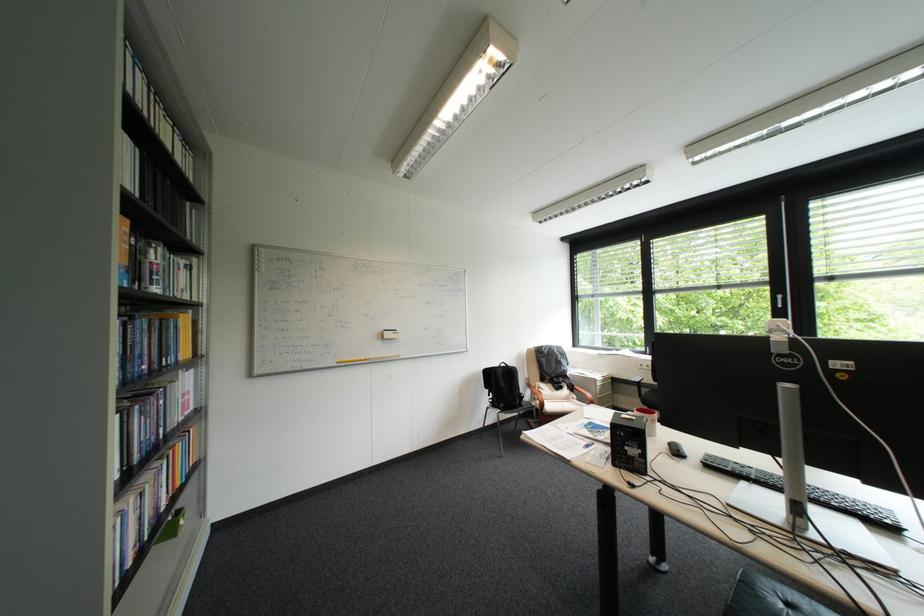
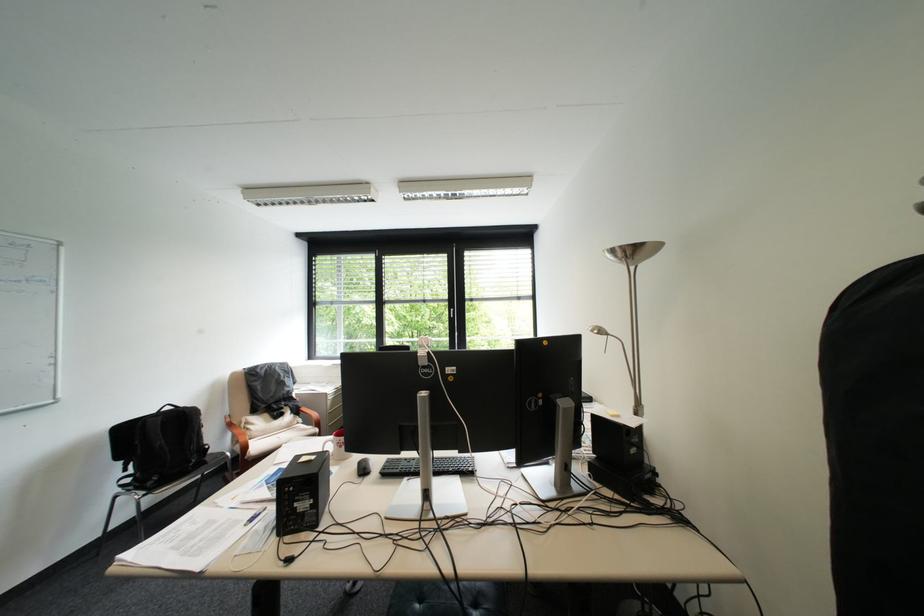
The point at [524,369] is marked in the first image. Where is the corresponding point in the second image?

(198, 411)